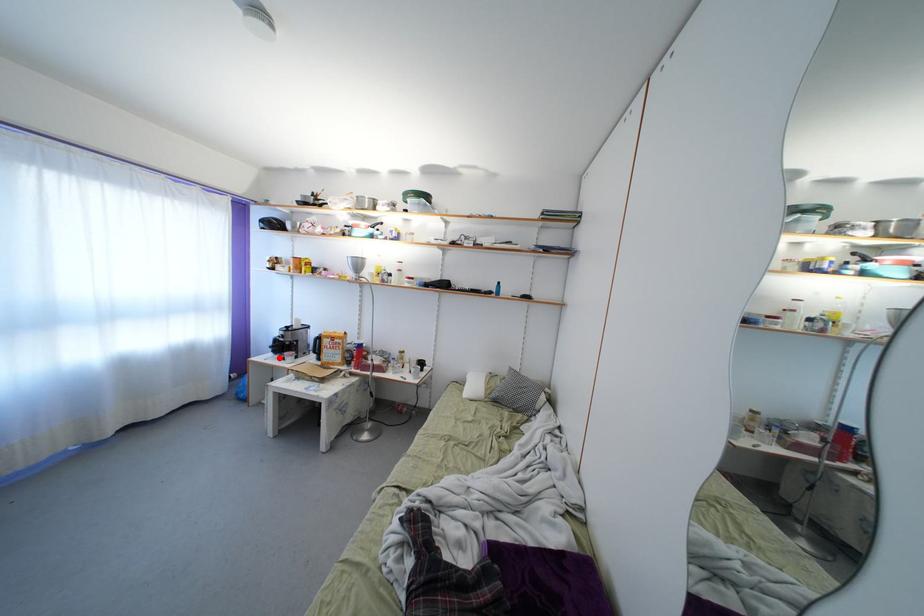
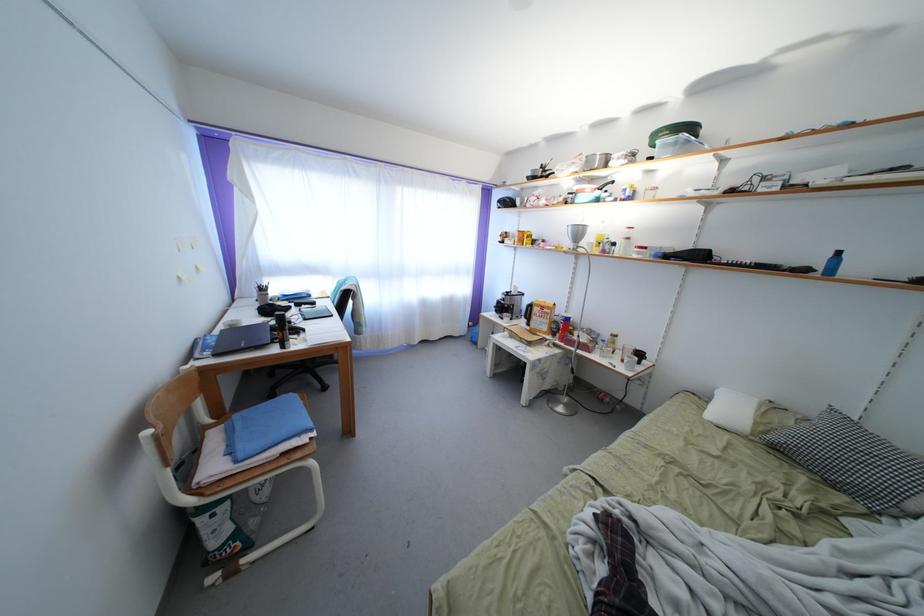
Where in the second image is the point corresponding to the highlighted location from the first image?

(503, 317)